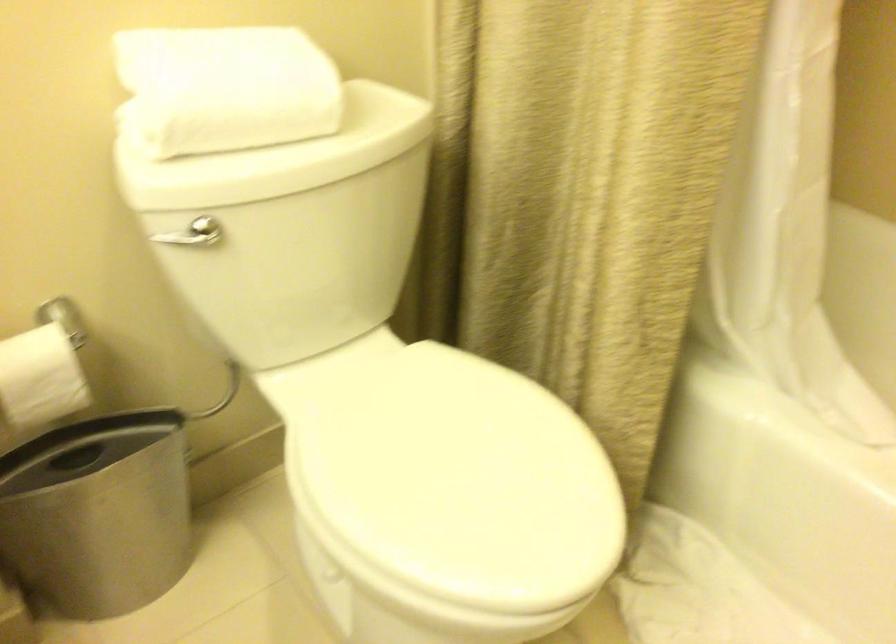
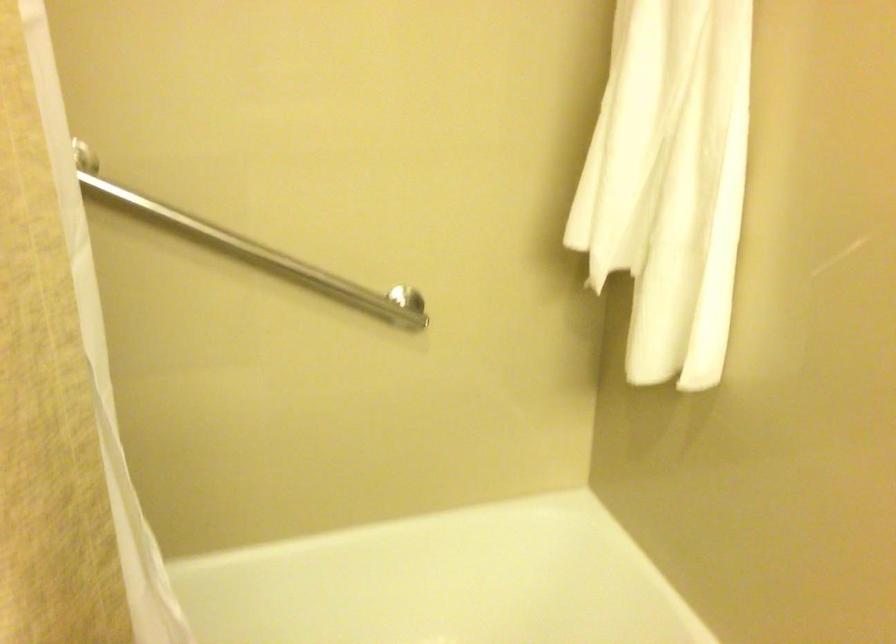
Question: The images are taken continuously from a first-person perspective. In which direction is your viewpoint rotating?

Choices:
 (A) Left
 (B) Right
 (C) Up
 (D) Down

Answer: (B)